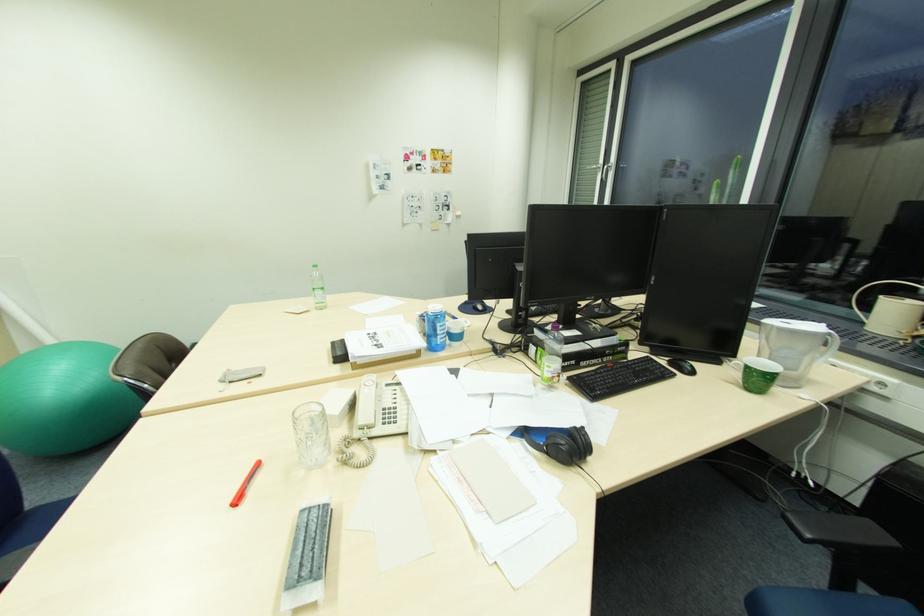
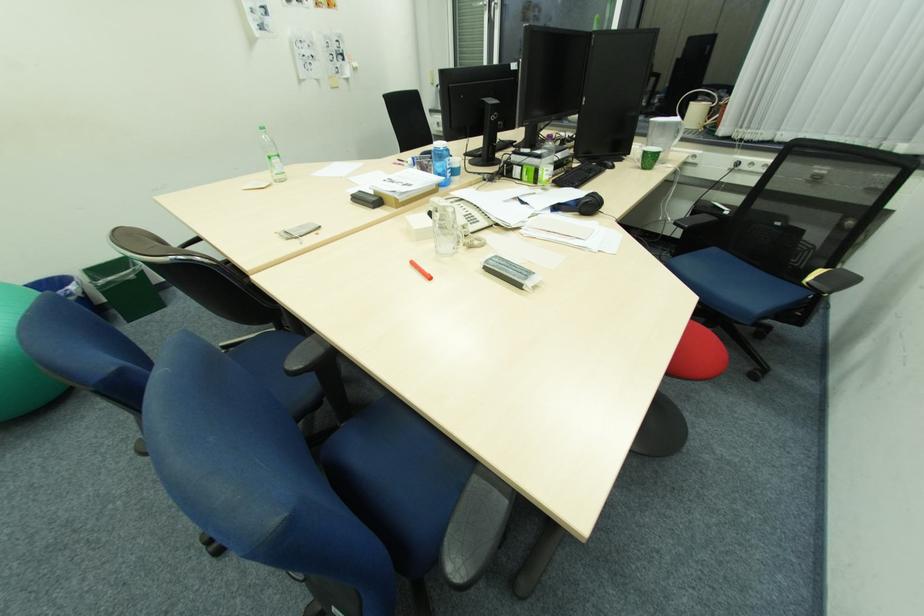
The point at (752, 368) is marked in the first image. Where is the corresponding point in the second image?

(650, 153)